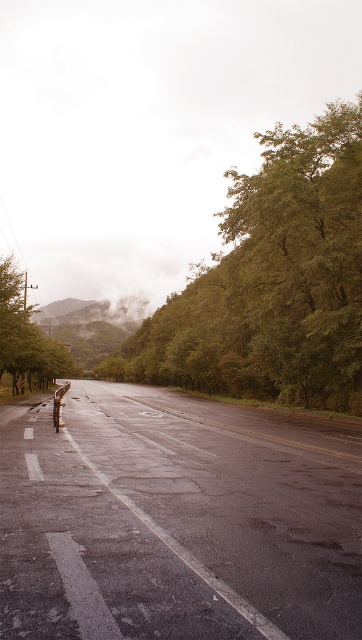
Between green leafy tree at center and green leafy tree at left, which one is positioned higher?

green leafy tree at center is above.

Is green leafy tree at center closer to camera compared to green leafy tree at left?

That is True.

Between point (325, 124) and point (9, 275), which one is positioned in front?

Point (9, 275) is more forward.

This screenshot has width=362, height=640. What are the coordinates of `green leafy tree at center` in the screenshot? It's located at (272, 282).